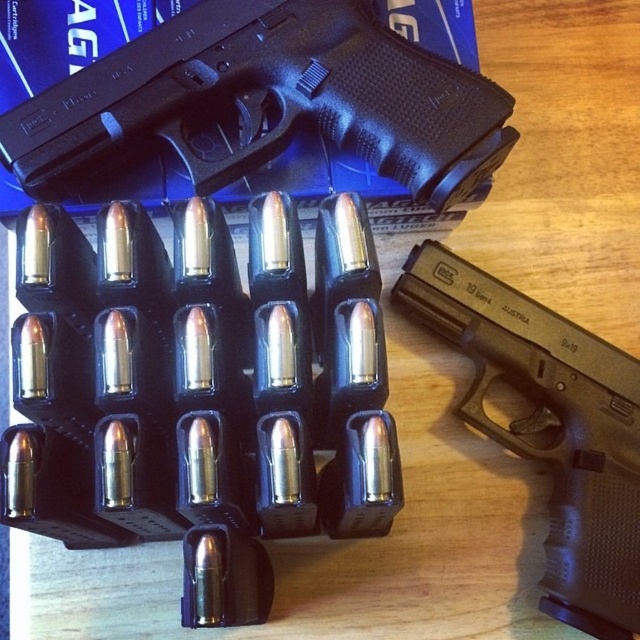
Which is above, black rubber handgun at upper center or black plastic handgun at center?

Positioned higher is black rubber handgun at upper center.

Which is in front, point (138, 67) or point (577, 365)?

Point (138, 67) is in front.

Where is `black rubber handgun at upper center`? black rubber handgun at upper center is located at coordinates (262, 104).

Where is `black rubber handgun at upper center`? The width and height of the screenshot is (640, 640). black rubber handgun at upper center is located at coordinates (262, 104).